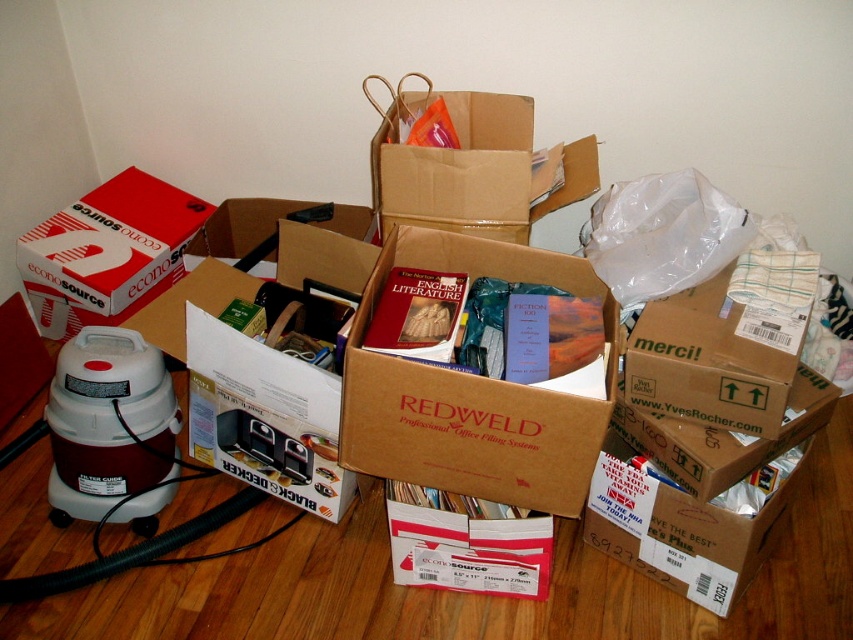
Who is more distant from viewer, (x=479, y=404) or (x=456, y=205)?

The point (x=456, y=205) is more distant.

From the picture: Is brown cardboard box at center below brown cardboard box at upper center?

Yes, brown cardboard box at center is below brown cardboard box at upper center.

Between point (422, 451) and point (527, 218), which one is positioned in front?

Positioned in front is point (422, 451).

Where is `brown cardboard box at center`? This screenshot has width=853, height=640. brown cardboard box at center is located at coordinates (473, 392).

Between brown cardboard box at upper center and red matte cardboard box at left, which one has more height?

red matte cardboard box at left

Between brown cardboard box at upper center and red matte cardboard box at left, which one appears on the left side from the viewer's perspective?

From the viewer's perspective, red matte cardboard box at left appears more on the left side.

Is point (508, 205) less distant than point (94, 221)?

Yes, point (508, 205) is closer to viewer.

This screenshot has height=640, width=853. Identify the location of brown cardboard box at upper center. (474, 168).

Can you confirm if brown cardboard box at center is positioned below red matte cardboard box at left?

Indeed, brown cardboard box at center is positioned under red matte cardboard box at left.

Who is lower down, brown cardboard box at center or red matte cardboard box at left?

brown cardboard box at center is below.

Who is more distant from viewer, (556, 420) or (78, 198)?

The point (78, 198) is more distant.

Identify the location of brown cardboard box at center. This screenshot has width=853, height=640. (473, 392).